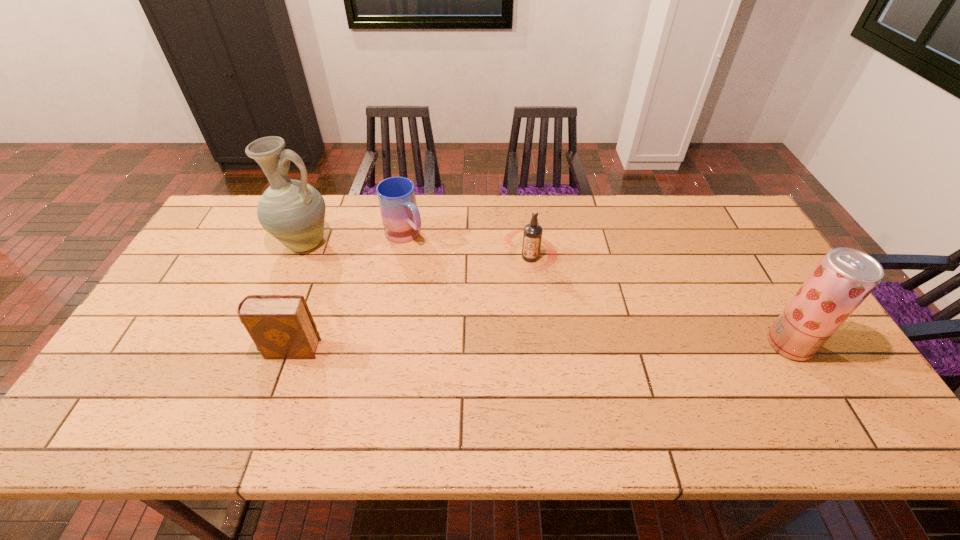
The width and height of the screenshot is (960, 540). Identify the location of diary. (282, 327).

At what (x,y) coordinates should I click in order to perform the action: click on fruit juice. Please return your answer as a coordinate pair (x, y). The height and width of the screenshot is (540, 960). Looking at the image, I should click on (842, 280).

At what (x,y) coordinates should I click in order to perform the action: click on the second tallest object. Please return your answer as a coordinate pair (x, y). The image size is (960, 540). Looking at the image, I should click on (842, 280).

Find the location of a particular element. mug is located at coordinates (400, 216).

This screenshot has height=540, width=960. In order to click on root beer in this screenshot , I will do `click(532, 236)`.

Where is `the tallest object`? Image resolution: width=960 pixels, height=540 pixels. the tallest object is located at coordinates (292, 211).

Where is `vacant point located 0.070m on the spine side of the diary`? This screenshot has width=960, height=540. vacant point located 0.070m on the spine side of the diary is located at coordinates (235, 349).

The image size is (960, 540). I want to click on vacant area situated 0.210m on the spine side of the diary, so click(x=181, y=349).

The width and height of the screenshot is (960, 540). In order to click on free space located 0.110m on the spine side of the diary in this screenshot , I will do point(220,349).

At what (x,y) coordinates should I click in order to perform the action: click on free space located 0.170m on the left of the fourth shortest object. Please return your answer as a coordinate pair (x, y). Image resolution: width=960 pixels, height=540 pixels. Looking at the image, I should click on (702, 345).